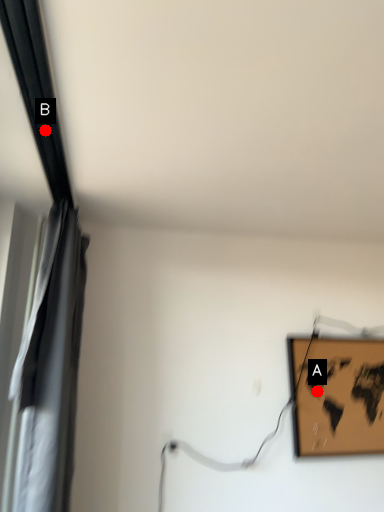
Question: Two points are circled on the image, labeled by A and B beside each circle. Which point is farther from the camera taking this photo?

Choices:
 (A) A is further
 (B) B is further

Answer: (A)